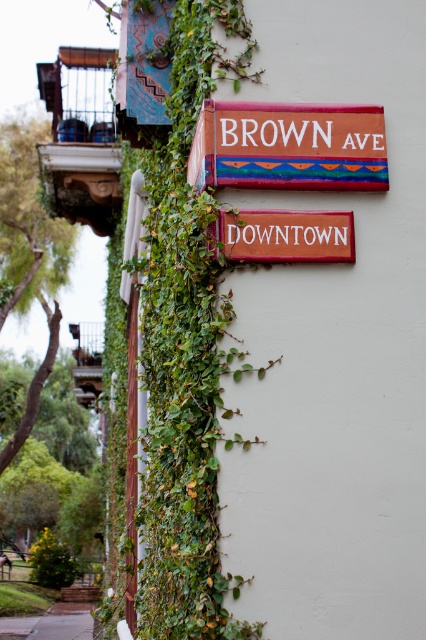
Where is `painted wood sign at upper center`? The height and width of the screenshot is (640, 426). painted wood sign at upper center is located at coordinates (288, 147).

Is painted wood sign at upper center smaller than red wood downtown sign at center?

No.

This screenshot has height=640, width=426. I want to click on painted wood sign at upper center, so click(288, 147).

Locate an element on the screen. The width and height of the screenshot is (426, 640). painted wood sign at upper center is located at coordinates (288, 147).